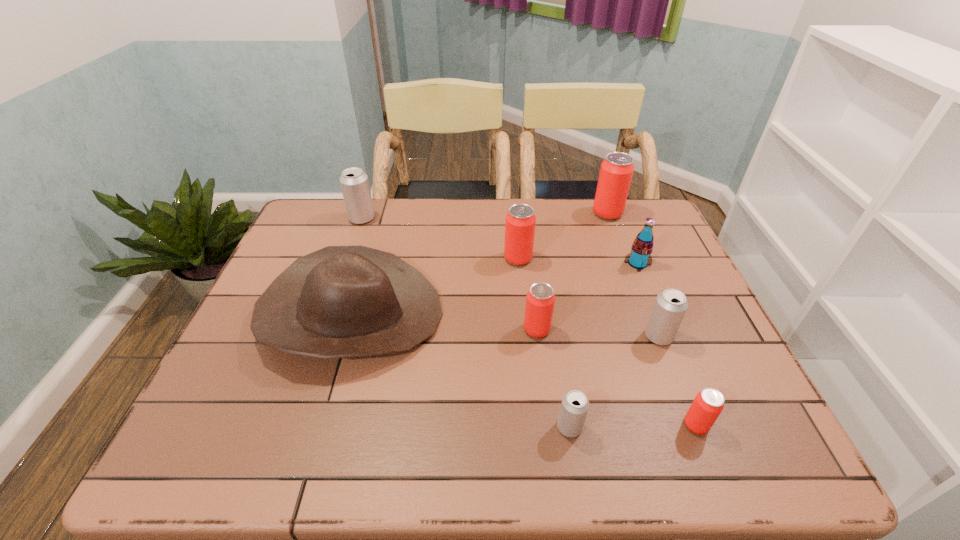
Locate an element on the screen. the second nearest red beer can is located at coordinates (540, 299).

Find the location of `the smallest white beer can`. the smallest white beer can is located at coordinates (574, 407).

The image size is (960, 540). Identify the location of the nearest white beer can. (574, 407).

Find the location of a particular element. Image resolution: width=960 pixels, height=540 pixels. the nearest red beer can is located at coordinates (708, 404).

This screenshot has width=960, height=540. Identify the location of blank area located on the left of the tallest beer can. coord(482,214).

Image resolution: width=960 pixels, height=540 pixels. Identify the location of free space located on the left of the fifth nearest beer can. (368, 259).

You are a GUI agent. You are given a task and a screenshot of the screen. Output one action in this format:
    pyautogui.click(x=<x>, y=<y>)
    Task: Click on the free space located on the front of the leftmost beer can
    The height and width of the screenshot is (540, 960).
    Given the screenshot: What is the action you would take?
    pyautogui.click(x=341, y=280)

Image resolution: width=960 pixels, height=540 pixels. What are the coordinates of `vacant point located 0.080m on the back of the cowboy hat` in the screenshot? It's located at (372, 247).

Find the location of a particular element. Image resolution: width=960 pixels, height=540 pixels. free space located 0.250m on the front of the soda is located at coordinates (670, 342).

This screenshot has width=960, height=540. What are the coordinates of `free location located 0.130m on the left of the second nearest white beer can` in the screenshot? It's located at (x=590, y=336).